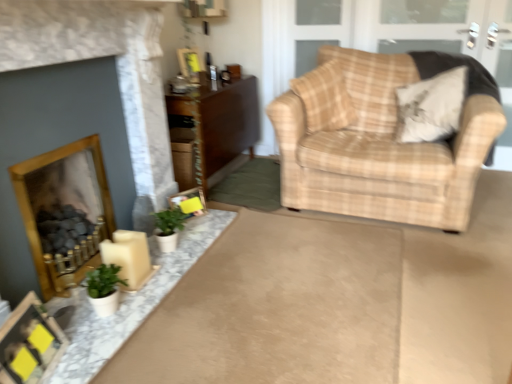
The height and width of the screenshot is (384, 512). I want to click on vacant space underneath green matte plant at lower left, which appears as the first houseplant when viewed from the front (from a real-world perspective), so click(x=105, y=309).